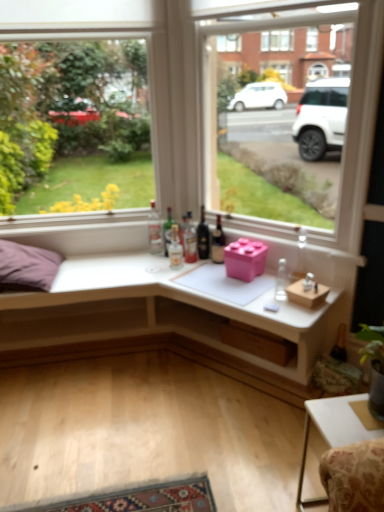
Image resolution: width=384 pixels, height=512 pixels. Find the location of `vacant space that is in between translucent glass bottle at center, acting as the fourth bottle starting from the left, and clear glass bottle at center, the first bottle positioned from the right`. vacant space that is in between translucent glass bottle at center, acting as the fourth bottle starting from the left, and clear glass bottle at center, the first bottle positioned from the right is located at coordinates (233, 281).